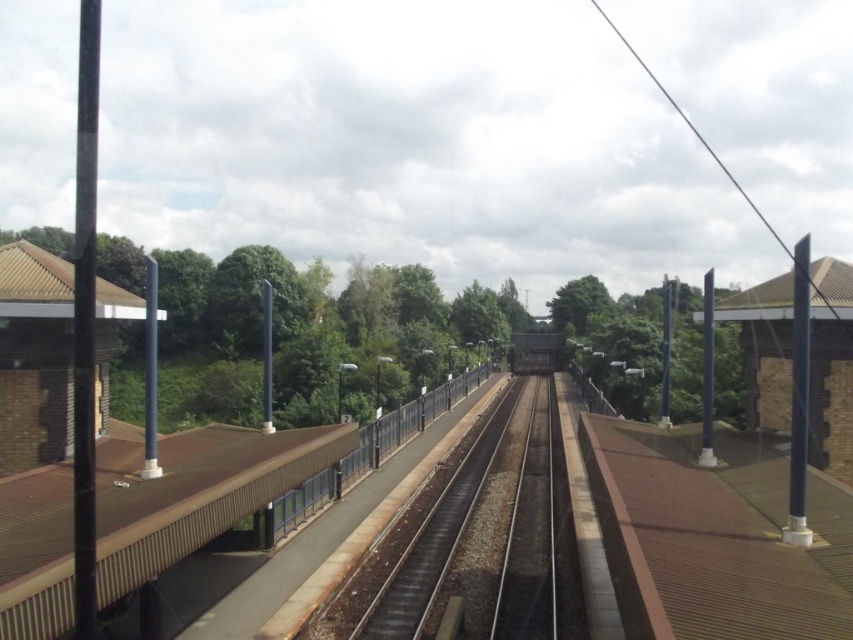
Is black asphalt track at center below brown concrete rail at center?

Yes.

Does black asphalt track at center lie in front of brown concrete rail at center?

No, it is not.

Is point (480, 579) positioned in front of point (363, 467)?

Yes, point (480, 579) is in front of point (363, 467).

Locate an element on the screen. The image size is (853, 640). black asphalt track at center is located at coordinates (477, 531).